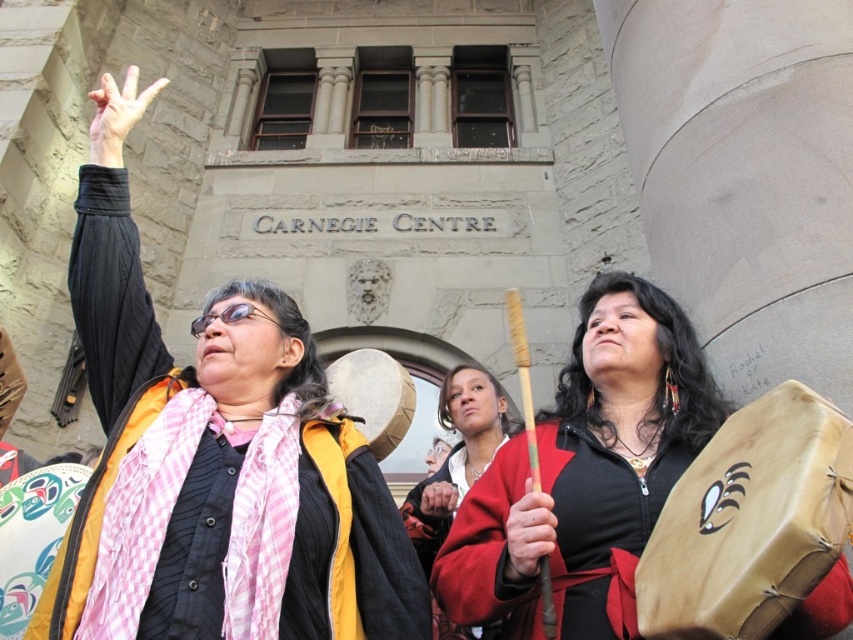
You are attending an event at Carnegie Centre and see two people in the foreground. The woman on the left is wearing a matte black jacket at upper left, and the woman in the center is wearing a matte red coat at center. Which piece of clothing is positioned more to the left?

The matte black jacket at upper left is positioned more to the left than the matte red coat at center.

You are standing at the entrance of Carnegie Centre and want to take a photo of the point at coordinates (x=775, y=612). Considering the distance, will you need a zoom lens to capture it clearly?

The point at coordinates (x=775, y=612) is 20.61 meters from the camera. A standard lens typically has a focal length of around 50mm, which may not be sufficient to capture distant objects clearly. To ensure the point is visible in the photo, a zoom lens with a longer focal length would be necessary to magnify the distant subject.

You are standing at the entrance of Carnegie Centre and see two points marked in the scene. Which point is closer to you, point (648,381) or point (833,422)?

Point (833,422) is closer to you because it is in front of point (648,381).